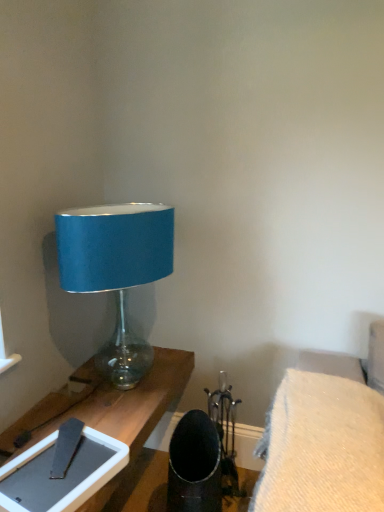
Find the location of a particular element. This screenshot has height=512, width=384. woolen fabric cushion at lower right is located at coordinates pyautogui.click(x=322, y=447).

From the image's perspective, which one is positioned lower, blue fabric lampshade at left or matte gray tablet at lower left?

matte gray tablet at lower left.

Is blue fabric lampshade at left facing away from matte gray tablet at lower left?

blue fabric lampshade at left is not turned away from matte gray tablet at lower left.

Between point (115, 205) and point (82, 454), which one is positioned in front?

The point (82, 454) is closer to the camera.

Relative to matte gray tablet at lower left, is woolen fabric cushion at lower right in front or behind?

Result: woolen fabric cushion at lower right is positioned closer to the viewer than matte gray tablet at lower left.

Is matte gray tablet at lower left inside woolen fabric cushion at lower right?

No, matte gray tablet at lower left is not a part of woolen fabric cushion at lower right.

Is woolen fabric cushion at lower right oriented towards matte gray tablet at lower left?

No, woolen fabric cushion at lower right is not oriented towards matte gray tablet at lower left.

Considering the positions of point (311, 433) and point (89, 490), is point (311, 433) closer or farther from the camera than point (89, 490)?

Point (311, 433) is farther from the camera than point (89, 490).

Does matte gray tablet at lower left touch blue fabric lampshade at left?

There is a gap between matte gray tablet at lower left and blue fabric lampshade at left.

How many degrees apart are the facing directions of matte gray tablet at lower left and blue fabric lampshade at left?

The angular difference between matte gray tablet at lower left and blue fabric lampshade at left is 4.37 degrees.

From a real-world perspective, is matte gray tablet at lower left under blue fabric lampshade at left?

Correct, in the physical world, matte gray tablet at lower left is lower than blue fabric lampshade at left.

Considering the points (16, 474) and (153, 232), which point is behind, point (16, 474) or point (153, 232)?

Point (153, 232)

Is woolen fabric cushion at lower right further to the viewer compared to blue fabric lampshade at left?

No, it is not.

From a real-world perspective, which object rests below the other?

woolen fabric cushion at lower right is physically lower.

Which of these two, woolen fabric cushion at lower right or blue fabric lampshade at left, is thinner?

Thinner between the two is blue fabric lampshade at left.

Considering the sizes of woolen fabric cushion at lower right and blue fabric lampshade at left in the image, is woolen fabric cushion at lower right taller or shorter than blue fabric lampshade at left?

Considering their sizes, woolen fabric cushion at lower right has less height than blue fabric lampshade at left.

Would you say matte gray tablet at lower left is inside or outside woolen fabric cushion at lower right?

The correct answer is: outside.

Which of these two, matte gray tablet at lower left or woolen fabric cushion at lower right, stands taller?

With more height is woolen fabric cushion at lower right.

Considering the sizes of objects matte gray tablet at lower left and woolen fabric cushion at lower right in the image provided, who is smaller, matte gray tablet at lower left or woolen fabric cushion at lower right?

matte gray tablet at lower left is smaller.

Where is `furniture above the matte gray tablet at lower left (from the image's perspective)`? This screenshot has width=384, height=512. furniture above the matte gray tablet at lower left (from the image's perspective) is located at coordinates [x=322, y=447].

Is blue fabric lampshade at left not inside woolen fabric cushion at lower right?

Yes, blue fabric lampshade at left is not within woolen fabric cushion at lower right.

From a real-world perspective, is blue fabric lampshade at left over woolen fabric cushion at lower right?

Yes, from a real-world perspective, blue fabric lampshade at left is above woolen fabric cushion at lower right.

In the scene shown: Can you confirm if blue fabric lampshade at left is taller than woolen fabric cushion at lower right?

Indeed, blue fabric lampshade at left has a greater height compared to woolen fabric cushion at lower right.

Which is behind, point (169, 242) or point (272, 441)?

The point (169, 242) is farther.

Where is `tablet computer below the blue fabric lampshade at left (from the image's perspective)`? tablet computer below the blue fabric lampshade at left (from the image's perspective) is located at coordinates (60, 479).

Where is `tablet computer behind the woolen fabric cushion at lower right`? tablet computer behind the woolen fabric cushion at lower right is located at coordinates 60,479.

Looking at the image, which one is located further to matte gray tablet at lower left, woolen fabric cushion at lower right or blue fabric lampshade at left?

The object further to matte gray tablet at lower left is blue fabric lampshade at left.

Estimate the real-world distances between objects in this image. Which object is closer to blue fabric lampshade at left, matte gray tablet at lower left or woolen fabric cushion at lower right?

The object closer to blue fabric lampshade at left is matte gray tablet at lower left.

Which object lies further to the anchor point woolen fabric cushion at lower right, matte gray tablet at lower left or blue fabric lampshade at left?

Among the two, blue fabric lampshade at left is located further to woolen fabric cushion at lower right.

From the image, which object appears to be nearer to matte gray tablet at lower left, blue fabric lampshade at left or woolen fabric cushion at lower right?

woolen fabric cushion at lower right is closer to matte gray tablet at lower left.

When comparing their distances from blue fabric lampshade at left, does woolen fabric cushion at lower right or matte gray tablet at lower left seem closer?

Based on the image, matte gray tablet at lower left appears to be nearer to blue fabric lampshade at left.

Based on their spatial positions, is blue fabric lampshade at left or matte gray tablet at lower left closer to woolen fabric cushion at lower right?

matte gray tablet at lower left.

Where is `lamp between matte gray tablet at lower left and woolen fabric cushion at lower right in the horizontal direction`? lamp between matte gray tablet at lower left and woolen fabric cushion at lower right in the horizontal direction is located at coordinates (116, 271).